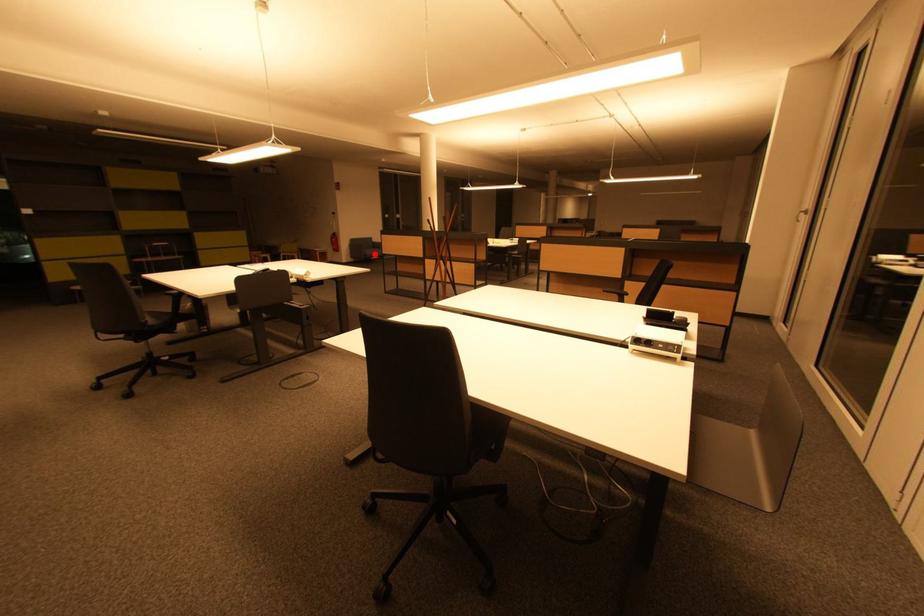
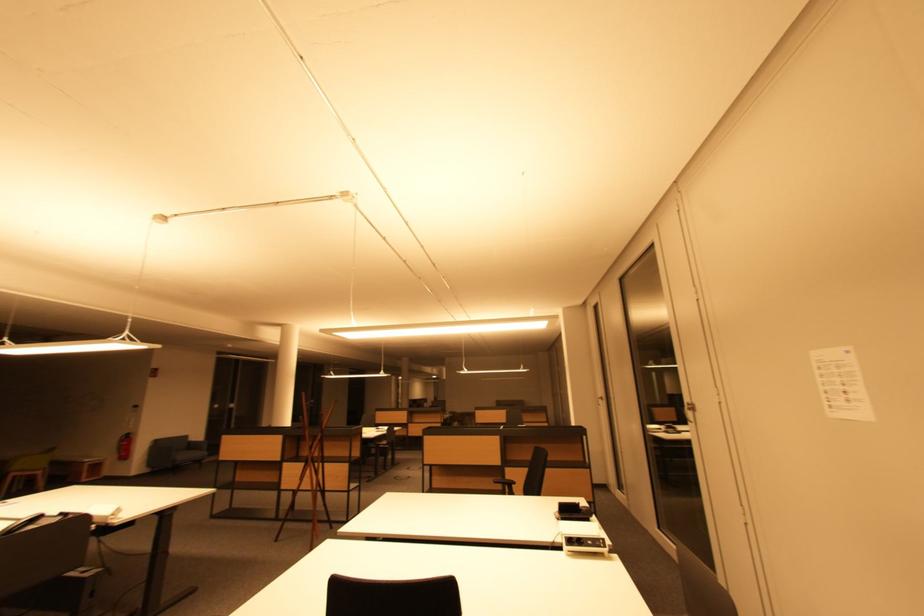
Question: A red point is marked in image1. In image2, is the corresponding 3D point closer to the camera or farther? Reply with the corresponding letter.

Choices:
 (A) The corresponding 3D point is closer.
 (B) The corresponding 3D point is farther.

Answer: (A)